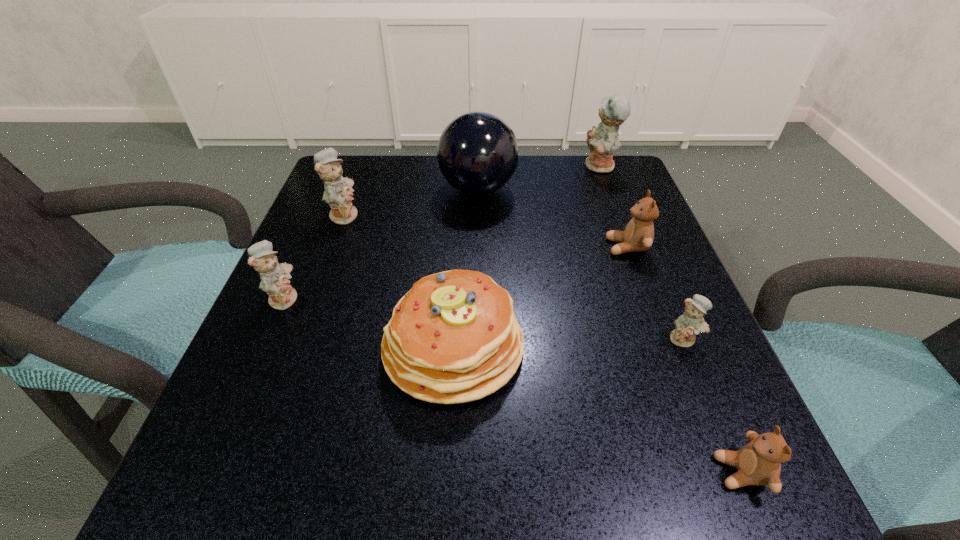
This screenshot has width=960, height=540. In order to click on the tallest teddy bear in this screenshot , I will do `click(602, 141)`.

The width and height of the screenshot is (960, 540). What are the coordinates of `the farthest blue teddy bear` in the screenshot? It's located at (602, 141).

Where is `black bowling ball`? black bowling ball is located at coordinates (477, 152).

This screenshot has width=960, height=540. Identify the location of the fifth nearest teddy bear. (338, 194).

The width and height of the screenshot is (960, 540). What are the coordinates of `the second biggest blue teddy bear` in the screenshot? It's located at (338, 194).

At what (x,y) coordinates should I click in order to perform the action: click on the farther brown teddy bear. Please return your answer as a coordinate pair (x, y). The width and height of the screenshot is (960, 540). Looking at the image, I should click on (638, 235).

Locate an element on the screen. Image resolution: width=960 pixels, height=540 pixels. the bigger brown teddy bear is located at coordinates (638, 235).

The width and height of the screenshot is (960, 540). I want to click on the third biggest blue teddy bear, so click(274, 277).

This screenshot has height=540, width=960. Find the location of `the fourth farthest teddy bear`. the fourth farthest teddy bear is located at coordinates (274, 277).

At what (x,y) coordinates should I click in order to perform the action: click on pancake. Please return your answer as a coordinate pair (x, y). Looking at the image, I should click on (453, 338).